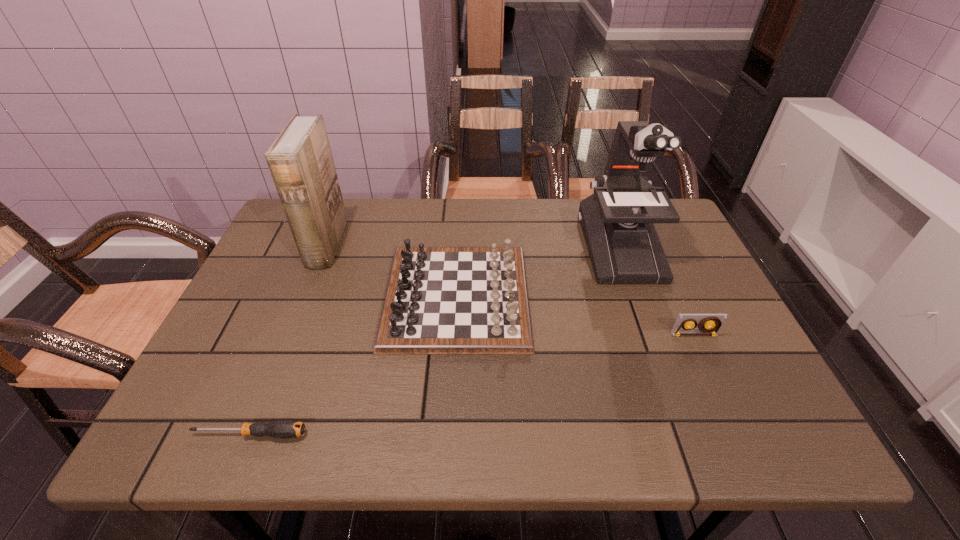
Where is `object present at the near left corner`? The height and width of the screenshot is (540, 960). object present at the near left corner is located at coordinates (283, 429).

The width and height of the screenshot is (960, 540). Identify the location of object that is at the far right corner. (617, 220).

The width and height of the screenshot is (960, 540). What are the coordinates of `free spot at the far edge of the desktop` in the screenshot? It's located at (407, 202).

Find the location of a particular element. This screenshot has height=540, width=960. free spot at the near edge of the desktop is located at coordinates (300, 417).

This screenshot has width=960, height=540. In order to click on vacant area at the near left corner of the desktop in this screenshot , I will do `click(191, 416)`.

Locate an element on the screen. vacant space at the far right corner of the desktop is located at coordinates (676, 234).

Where is `free space between the screwdriver and the chessboard`? free space between the screwdriver and the chessboard is located at coordinates (353, 366).

The width and height of the screenshot is (960, 540). In order to click on vacant space that's between the microscope and the phonebook in this screenshot , I will do `click(473, 246)`.

What are the coordinates of `vacant space in between the third shortest object and the microscope` in the screenshot? It's located at (538, 272).

Find the location of a particular element. free spot between the fourth tallest object and the microscope is located at coordinates (657, 291).